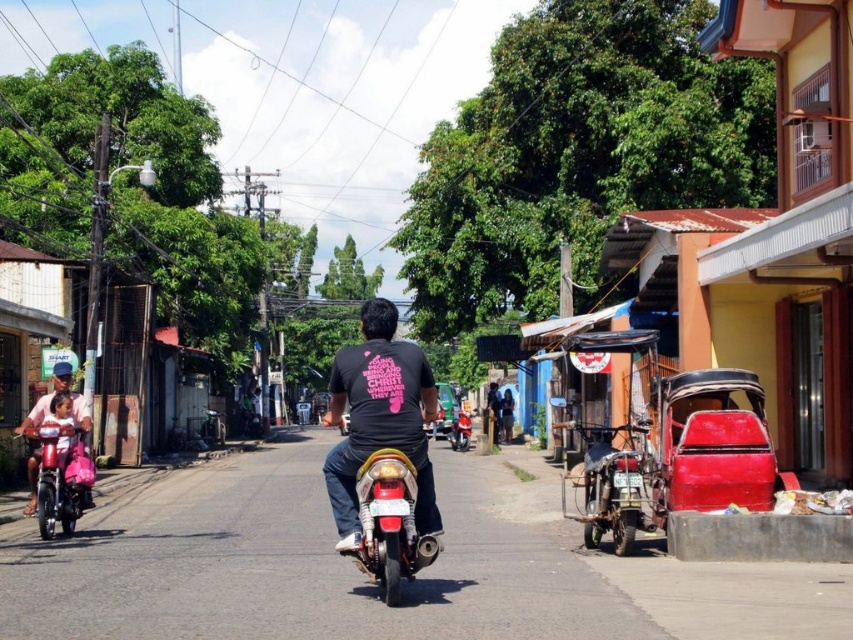
Is black matte shirt at center wider than shiny chrome motorcycle at center?

Yes.

Does black matte shirt at center appear under shiny chrome motorcycle at center?

Yes.

Locate an element on the screen. The width and height of the screenshot is (853, 640). black matte shirt at center is located at coordinates (379, 417).

Who is more distant from viewer, [426,403] or [49,529]?

Positioned behind is point [49,529].

Which is above, black matte shirt at center or metallic pink scooter at lower left?

metallic pink scooter at lower left is above.

The image size is (853, 640). Describe the element at coordinates (379, 417) in the screenshot. I see `black matte shirt at center` at that location.

I want to click on black matte shirt at center, so click(x=379, y=417).

Who is positioned more to the left, shiny chrome motorcycle at center or metallic red motorcycle at center?

From the viewer's perspective, shiny chrome motorcycle at center appears more on the left side.

Does shiny chrome motorcycle at center have a greater width compared to metallic red motorcycle at center?

Correct, the width of shiny chrome motorcycle at center exceeds that of metallic red motorcycle at center.

Which is behind, point (364, 529) or point (469, 428)?

Point (469, 428)

Where is `shiny chrome motorcycle at center`? This screenshot has height=640, width=853. shiny chrome motorcycle at center is located at coordinates (389, 518).